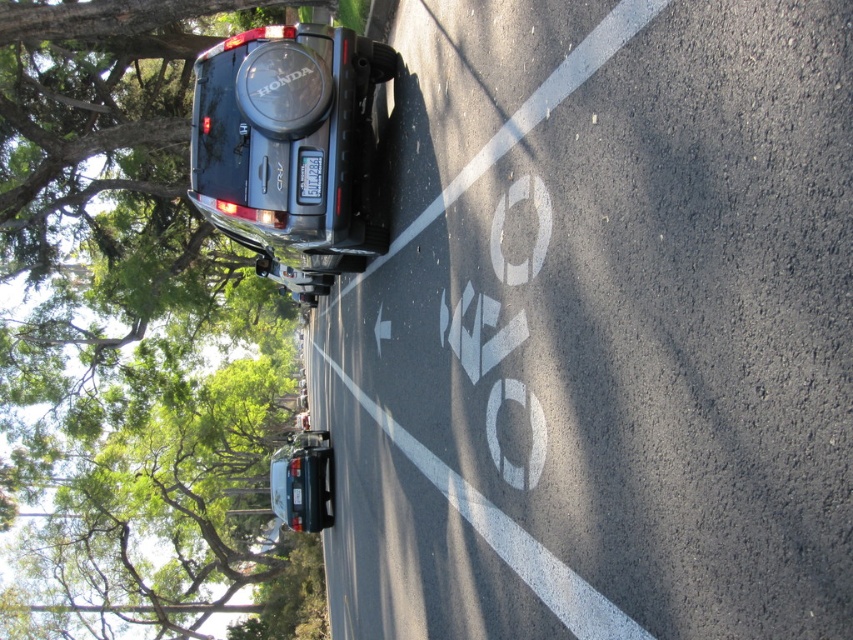
Question: Which is nearer to the shiny silver sedan at center?

Choices:
 (A) white asphalt bike lane at upper center
 (B) white plastic license plate at center

Answer: (A)

Question: Does matte black suv at center have a larger size compared to shiny silver sedan at center?

Choices:
 (A) no
 (B) yes

Answer: (A)

Question: Which object appears closest to the camera in this image?

Choices:
 (A) shiny silver sedan at center
 (B) white asphalt bike lane at upper center

Answer: (B)

Question: Which of these objects is positioned farthest from the shiny silver sedan at center?

Choices:
 (A) green leafy tree at upper left
 (B) matte black suv at center
 (C) white asphalt bike lane at upper center

Answer: (B)

Question: Does white asphalt bike lane at upper center appear on the left side of shiny silver sedan at center?

Choices:
 (A) no
 (B) yes

Answer: (A)

Question: Is green leafy tree at upper left behind matte black suv at center?

Choices:
 (A) yes
 (B) no

Answer: (A)